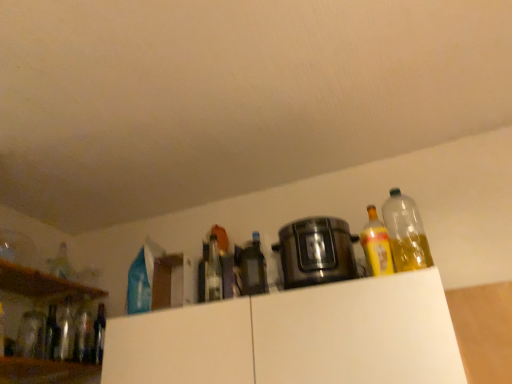
Question: Is white matte cabinet at upper center, which appears as the second cabinetry when viewed from the right, completely or partially outside of white matte cabinet at upper center, placed as the first cabinetry when sorted from right to left?

Choices:
 (A) no
 (B) yes

Answer: (B)

Question: Does white matte cabinet at upper center, which appears as the second cabinetry when viewed from the right, have a greater width compared to white matte cabinet at upper center, placed as the first cabinetry when sorted from right to left?

Choices:
 (A) no
 (B) yes

Answer: (A)

Question: Can you confirm if white matte cabinet at upper center, which appears as the second cabinetry when viewed from the right, is positioned to the right of white matte cabinet at upper center, placed as the first cabinetry when sorted from right to left?

Choices:
 (A) no
 (B) yes

Answer: (A)

Question: Can you confirm if white matte cabinet at upper center, arranged as the first cabinetry when viewed from the left, is positioned to the left of white matte cabinet at upper center, placed as the first cabinetry when sorted from right to left?

Choices:
 (A) no
 (B) yes

Answer: (B)

Question: From the image's perspective, is white matte cabinet at upper center, arranged as the first cabinetry when viewed from the left, beneath white matte cabinet at upper center, which is the second cabinetry in left-to-right order?

Choices:
 (A) no
 (B) yes

Answer: (A)

Question: Considering the relative positions of white matte cabinet at upper center, which appears as the second cabinetry when viewed from the right, and white matte cabinet at upper center, which is the second cabinetry in left-to-right order, in the image provided, is white matte cabinet at upper center, which appears as the second cabinetry when viewed from the right, behind white matte cabinet at upper center, which is the second cabinetry in left-to-right order,?

Choices:
 (A) yes
 (B) no

Answer: (A)

Question: Is white matte cabinet at upper center, arranged as the first cabinetry when viewed from the left, beside matte glass bottle at center, the 3th bottle in the right-to-left sequence?

Choices:
 (A) yes
 (B) no

Answer: (B)

Question: From the image's perspective, is white matte cabinet at upper center, arranged as the first cabinetry when viewed from the left, on matte glass bottle at center, the seventh bottle when ordered from left to right?

Choices:
 (A) yes
 (B) no

Answer: (B)

Question: Considering the relative sizes of white matte cabinet at upper center, which appears as the second cabinetry when viewed from the right, and matte glass bottle at center, the seventh bottle when ordered from left to right, in the image provided, is white matte cabinet at upper center, which appears as the second cabinetry when viewed from the right, shorter than matte glass bottle at center, the seventh bottle when ordered from left to right,?

Choices:
 (A) yes
 (B) no

Answer: (B)

Question: Is the position of white matte cabinet at upper center, which appears as the second cabinetry when viewed from the right, more distant than that of matte glass bottle at center, the seventh bottle when ordered from left to right?

Choices:
 (A) yes
 (B) no

Answer: (A)

Question: Considering the relative positions of white matte cabinet at upper center, which appears as the second cabinetry when viewed from the right, and matte glass bottle at center, the seventh bottle when ordered from left to right, in the image provided, is white matte cabinet at upper center, which appears as the second cabinetry when viewed from the right, to the right of matte glass bottle at center, the seventh bottle when ordered from left to right, from the viewer's perspective?

Choices:
 (A) yes
 (B) no

Answer: (B)

Question: From a real-world perspective, is white matte cabinet at upper center, which appears as the second cabinetry when viewed from the right, on top of matte glass bottle at center, the 3th bottle in the right-to-left sequence?

Choices:
 (A) yes
 (B) no

Answer: (B)

Question: Is translucent glass bottle at left, the ninth bottle when ordered from right to left, at the left side of translucent glass bottle at left, the third bottle viewed from the left?

Choices:
 (A) yes
 (B) no

Answer: (A)